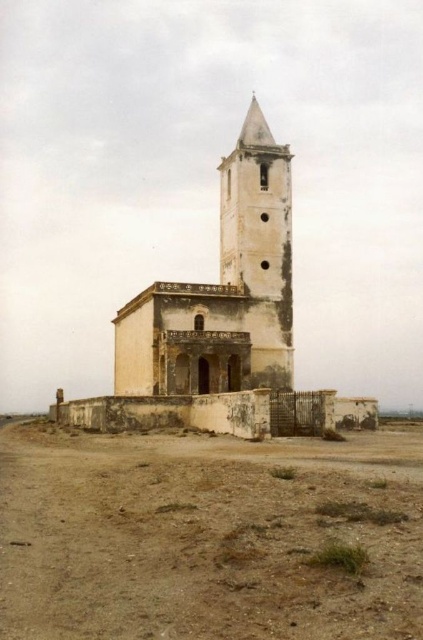
Does brown sandy dirt field at lower left appear over smooth beige stone bell tower at center?

Incorrect, brown sandy dirt field at lower left is not positioned above smooth beige stone bell tower at center.

Does brown sandy dirt field at lower left have a larger size compared to smooth beige stone bell tower at center?

No.

Is point (62, 461) positioned before point (236, 220)?

That is True.

The image size is (423, 640). Identify the location of brown sandy dirt field at lower left. (205, 538).

Does brown sandy dirt field at lower left appear on the right side of white weathered church at center?

Correct, you'll find brown sandy dirt field at lower left to the right of white weathered church at center.

Which of these two, brown sandy dirt field at lower left or white weathered church at center, stands taller?

white weathered church at center

I want to click on brown sandy dirt field at lower left, so click(205, 538).

Is white weathered church at center below smooth beige stone bell tower at center?

Correct, white weathered church at center is located below smooth beige stone bell tower at center.

Between point (139, 348) and point (271, 164), which one is positioned behind?

The point (271, 164) is more distant.

This screenshot has width=423, height=640. Find the location of `white weathered church at center`. white weathered church at center is located at coordinates (222, 324).